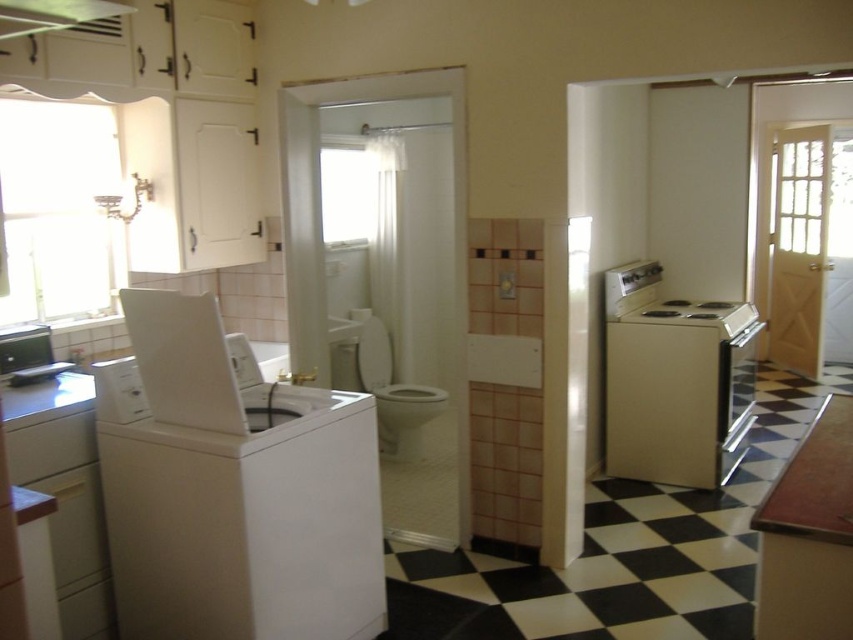
You are standing in the kitchen and bathroom area and want to determine the relative positions of two points marked in the image. Which point is closer to you, point (254, 461) or point (604, 396)?

Point (254, 461) is closer to you than point (604, 396).

You are moving a 6 feet long ladder through this kitchen and bathroom area. The ladder needs to be moved from the area near the white matte washing machine at left to the area near the white glossy toilet bowl at center. Can the ladder fit through the space between them without bending it?

The distance between the white matte washing machine at left and the white glossy toilet bowl at center is 6.32 feet. Since the ladder is 6 feet long, it can fit through the space between them as the distance is slightly longer than the ladder.